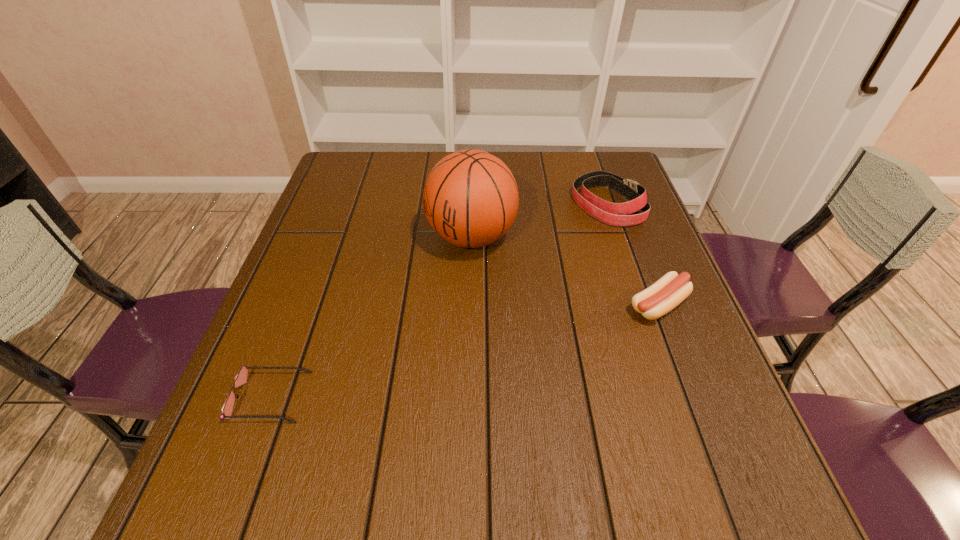
At what (x,y) coordinates should I click in order to perform the action: click on vacant space located on the bridge of the leftmost object. Please return your answer as a coordinate pair (x, y). The width and height of the screenshot is (960, 540). Looking at the image, I should click on (353, 397).

Find the location of a particular element. object present at the far edge is located at coordinates (616, 214).

Find the location of `object situated at the left edge`. object situated at the left edge is located at coordinates (241, 378).

At what (x,y) coordinates should I click in order to perform the action: click on dog collar situated at the right edge. Please return your answer as a coordinate pair (x, y). The image size is (960, 540). Looking at the image, I should click on (616, 214).

At what (x,y) coordinates should I click in order to perform the action: click on sausage that is at the right edge. Please return your answer as a coordinate pair (x, y). Looking at the image, I should click on (669, 291).

I want to click on object present at the far right corner, so click(x=616, y=214).

You are a GUI agent. You are given a task and a screenshot of the screen. Output one action in this format:
    pyautogui.click(x=<x>, y=<y>)
    Task: Click on the vacant space at the far edge
    
    Given the screenshot: What is the action you would take?
    pyautogui.click(x=532, y=168)

Where is `vacant region at the near edge of the desktop`? vacant region at the near edge of the desktop is located at coordinates (370, 471).

This screenshot has width=960, height=540. Find the location of `vacant space at the left edge`. vacant space at the left edge is located at coordinates (308, 248).

Find the location of a particular element. vacant region at the far left corner of the desktop is located at coordinates (362, 188).